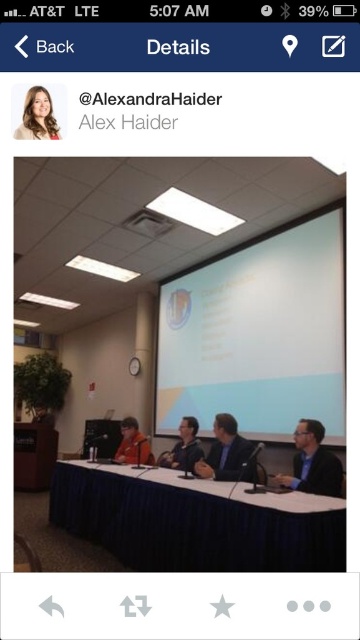
From the picture: You are a photographer trying to capture a closeup of the matte black suit at center without including the blue fabric table at center in the frame. Based on their positions, is this possible?

The blue fabric table at center is in front of the matte black suit at center, so it would block the view. You cannot capture a closeup of the matte black suit at center without including the blue fabric table at center in the frame.

You are attending a virtual conference and see this image. You need to locate the white glossy projection screen at upper center and the matte black suit at center. Which object is positioned to the right of the other?

The white glossy projection screen at upper center is to the right of the matte black suit at center.

You are a photographer attending a conference and need to take a photo of the panel discussion. The white glossy projection screen at upper center and the matte black suit at center are both in your viewfinder. Which object is positioned higher in the frame?

The white glossy projection screen at upper center is positioned higher in the frame than the matte black suit at center.